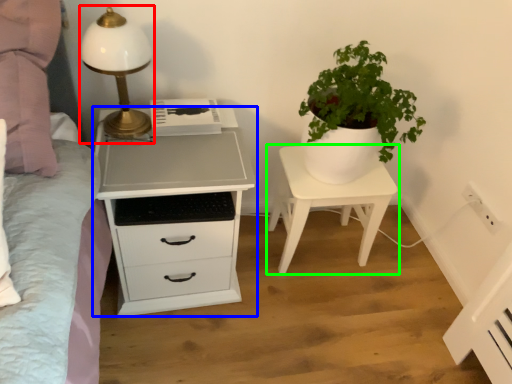
Question: Considering the real-world distances, which object is farthest from table lamp (highlighted by a red box)? chest of drawers (highlighted by a blue box) or nightstand (highlighted by a green box)?

Choices:
 (A) chest of drawers
 (B) nightstand

Answer: (B)